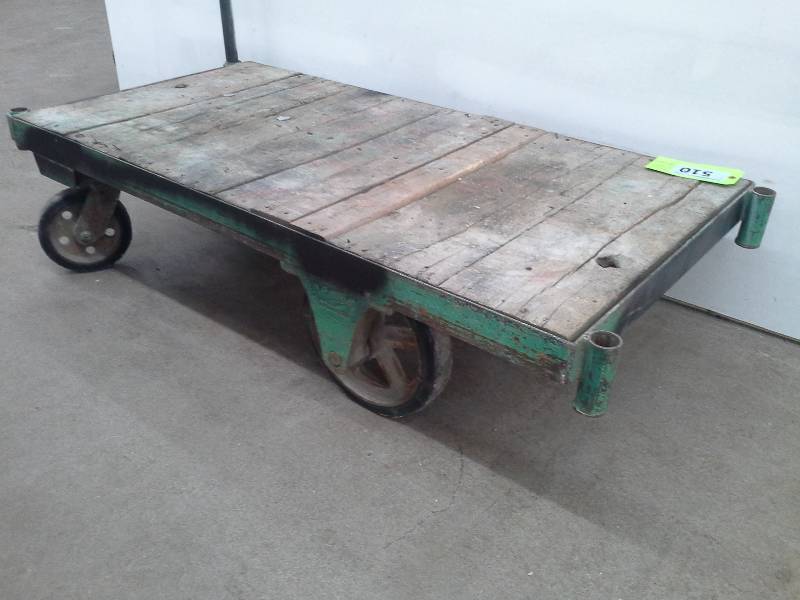
Where is `wall`? The width and height of the screenshot is (800, 600). wall is located at coordinates (128, 78), (493, 92), (728, 114), (782, 223), (752, 280).